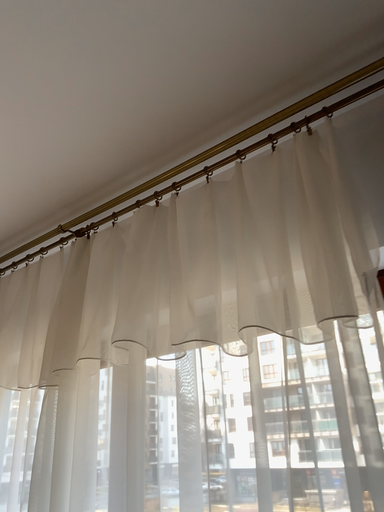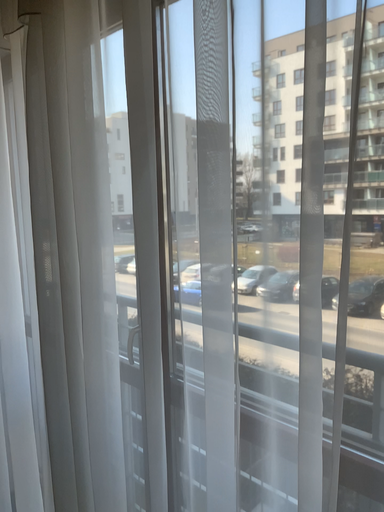
Question: Which way did the camera rotate in the video?

Choices:
 (A) rotated right
 (B) rotated left

Answer: (B)